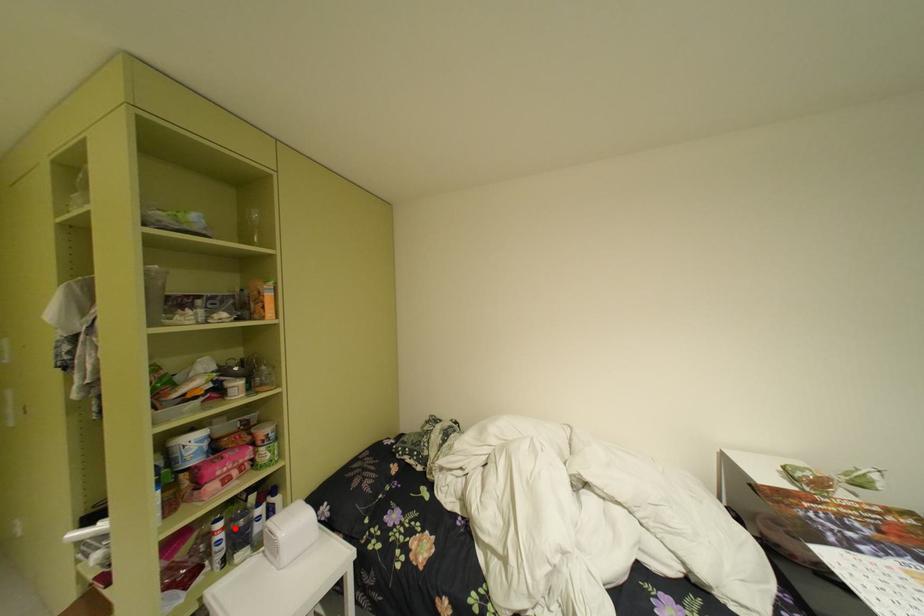
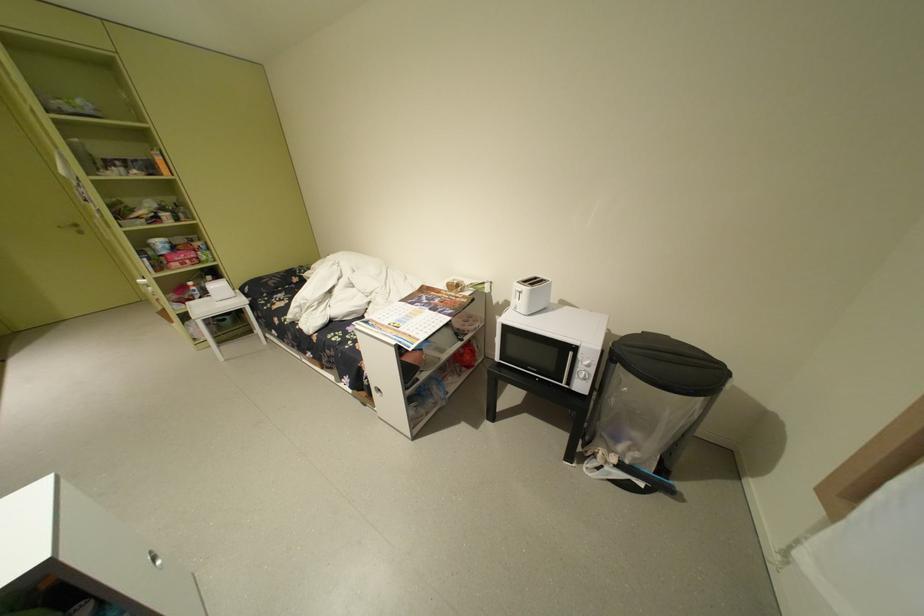
The point at the highlighted location is marked in the first image. Where is the corresponding point in the second image?

(204, 286)